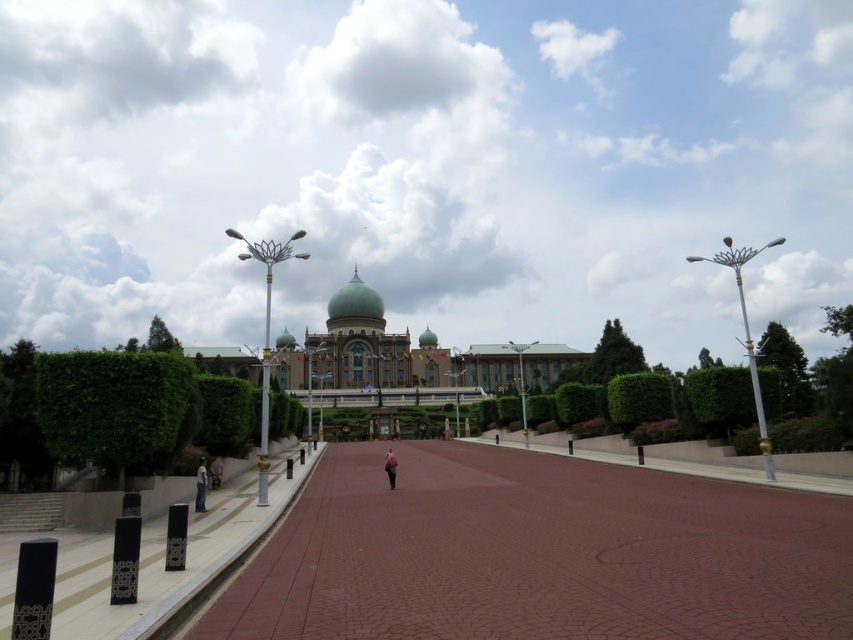
Measure the distance between point (811,584) and camera.

Point (811,584) and camera are 26.95 meters apart from each other.

Is point (338, 600) closer to viewer compared to point (44, 419)?

Yes, it is.

Is point (379, 525) closer to camera compared to point (19, 433)?

Yes, it is.

You are a GUI agent. You are given a task and a screenshot of the screen. Output one action in this format:
    pyautogui.click(x=<x>, y=<y>)
    Task: Click on the brick paved walkway at center
    The height and width of the screenshot is (640, 853).
    Given the screenshot: What is the action you would take?
    pyautogui.click(x=538, y=554)

Is green leafy hedge at left further to camera compared to white concrete path at lower left?

Yes.

Is green leafy hedge at left wider than white concrete path at lower left?

Yes.

Locate an element on the screen. The width and height of the screenshot is (853, 640). green leafy hedge at left is located at coordinates (114, 412).

What are the coordinates of `green leafy hedge at left` in the screenshot? It's located at (114, 412).

What do you see at coordinates (405, 353) in the screenshot? I see `green glossy palace at center` at bounding box center [405, 353].

Does green glossy palace at center appear on the right side of dark brown leather jacket at center?

In fact, green glossy palace at center is to the left of dark brown leather jacket at center.

The image size is (853, 640). What do you see at coordinates (405, 353) in the screenshot?
I see `green glossy palace at center` at bounding box center [405, 353].

The image size is (853, 640). In order to click on green glossy palace at center in this screenshot , I will do `click(405, 353)`.